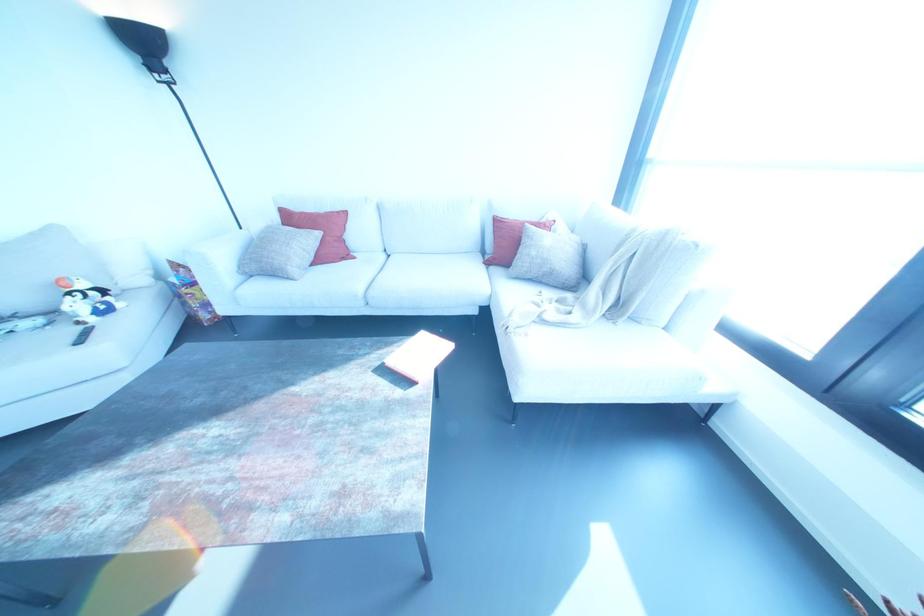
Find the location of `black lamp head`. black lamp head is located at coordinates (140, 34).